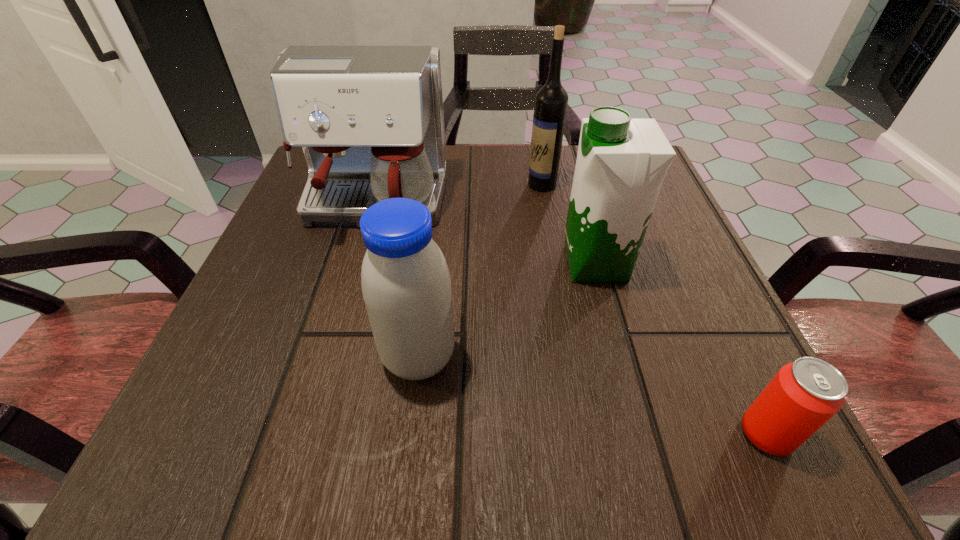
You are a GUI agent. You are given a task and a screenshot of the screen. Output one action in this format:
    pyautogui.click(x=<x>, y=<y>)
    Task: Click on the vacant area situated 0.360m on the front-facing side of the right soya milk
    
    Given the screenshot: What is the action you would take?
    pyautogui.click(x=349, y=264)

Locate an element on the screen. The width and height of the screenshot is (960, 540). blank space located 0.160m on the front-facing side of the right soya milk is located at coordinates (467, 264).

Find the location of a particular element. Image resolution: width=960 pixels, height=540 pixels. vacant region located 0.340m on the front-facing side of the right soya milk is located at coordinates (361, 264).

The image size is (960, 540). Find the location of `vacant region located 0.210m on the front of the coffee maker near the spout`. vacant region located 0.210m on the front of the coffee maker near the spout is located at coordinates (332, 343).

Find the location of a particular element. free space located on the back of the second nearest object is located at coordinates (433, 237).

In order to click on free space located on the back of the rightmost object in this screenshot , I will do 671,234.

Where is `wine bottle at the far edge`? The height and width of the screenshot is (540, 960). wine bottle at the far edge is located at coordinates (551, 100).

Locate an element on the screen. Image resolution: width=960 pixels, height=540 pixels. coffee maker located at the far edge is located at coordinates [370, 121].

What are the coordinates of `object located in the near edge section of the desktop` in the screenshot? It's located at (805, 394).

At what (x,y) coordinates should I click in order to perform the action: click on object present at the left edge. Please return your answer as a coordinate pair (x, y). This screenshot has width=960, height=540. Looking at the image, I should click on (370, 121).